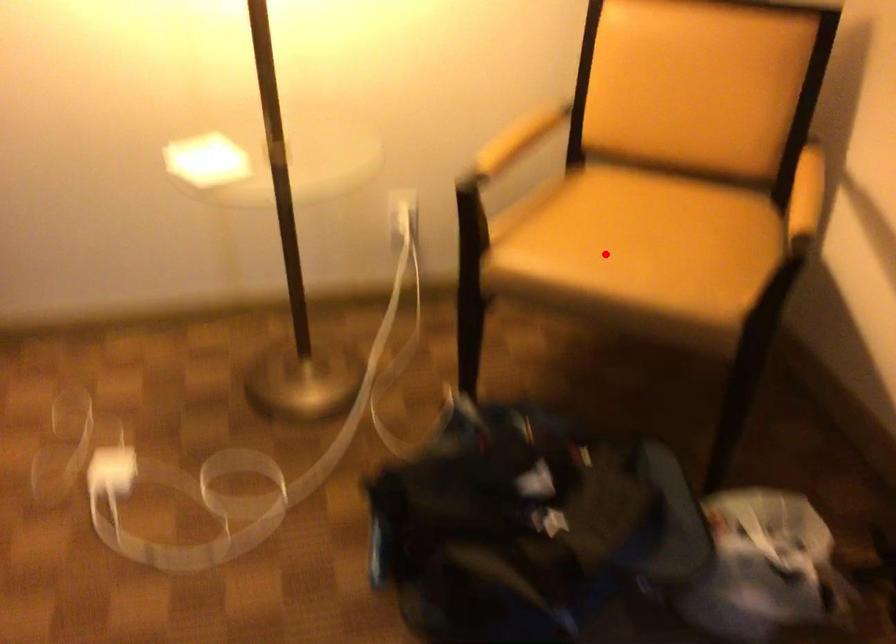
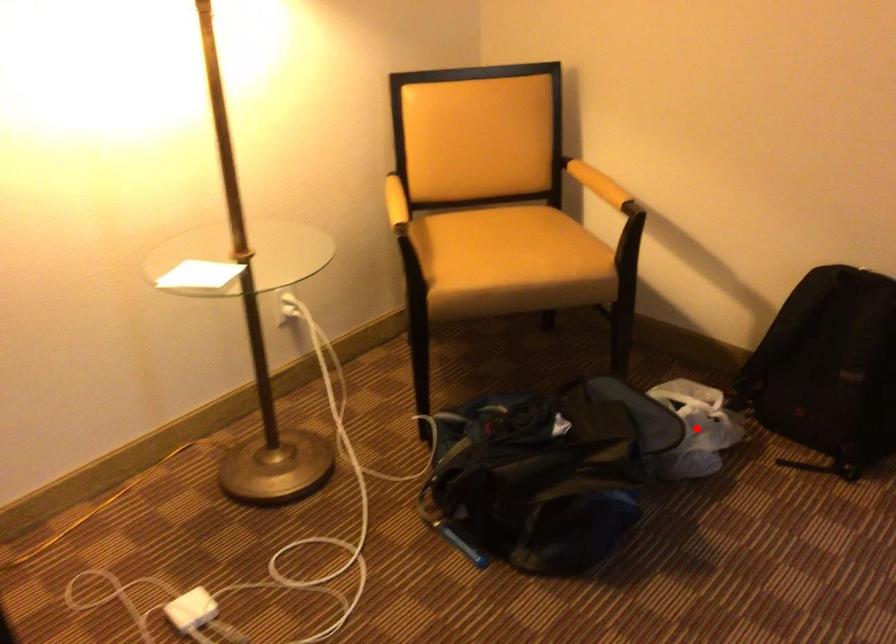
I am providing you with two images of the same scene from different viewpoints. A red point is marked on the first image and another point is marked on the second image. Is the marked point in image1 the same physical position as the marked point in image2?

No